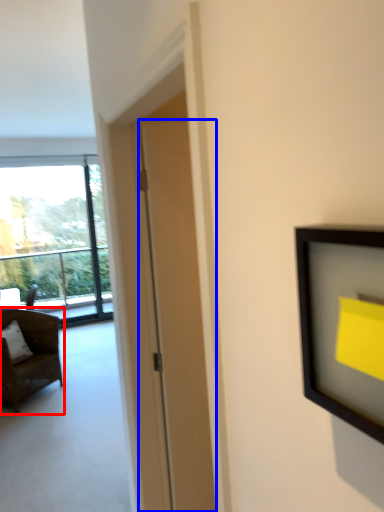
Question: Which object is further to the camera taking this photo, chair (highlighted by a red box) or door (highlighted by a blue box)?

Choices:
 (A) chair
 (B) door

Answer: (A)